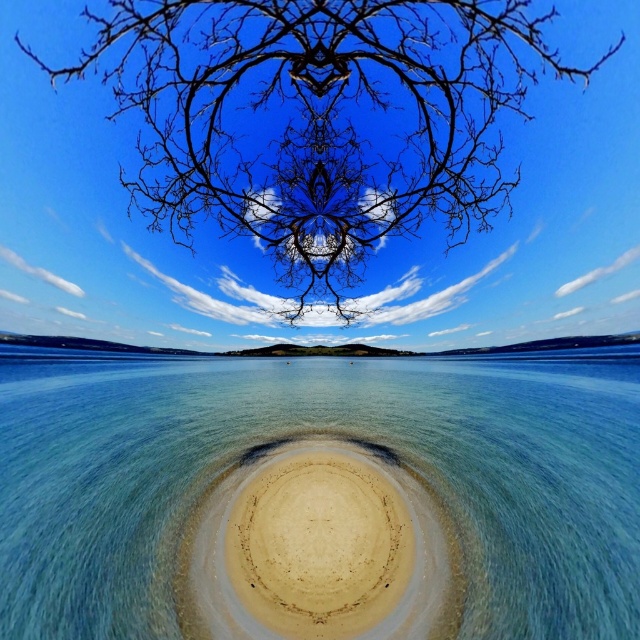
Which is above, clear water at center or beige sandy island at center?

clear water at center is higher up.

Find the location of a particular element. The image size is (640, 640). clear water at center is located at coordinates (332, 436).

Describe the element at coordinates (332, 436) in the screenshot. This screenshot has width=640, height=640. I see `clear water at center` at that location.

Is clear water at center positioned at the back of black matte tree at upper center?

No.

This screenshot has height=640, width=640. Identify the location of clear water at center. (332, 436).

Which is below, black matte tree at upper center or beige sandy island at center?

Positioned lower is beige sandy island at center.

Is black matte tree at upper center shorter than beige sandy island at center?

No.

Does point (401, 180) come behind point (420, 554)?

Yes, point (401, 180) is farther from viewer.

The image size is (640, 640). What are the coordinates of `black matte tree at upper center` in the screenshot? It's located at (320, 120).